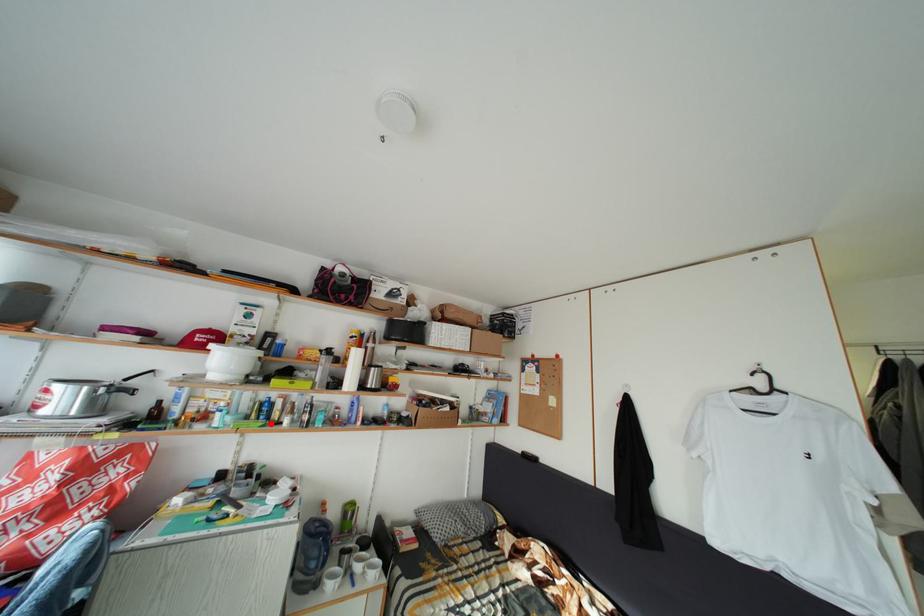
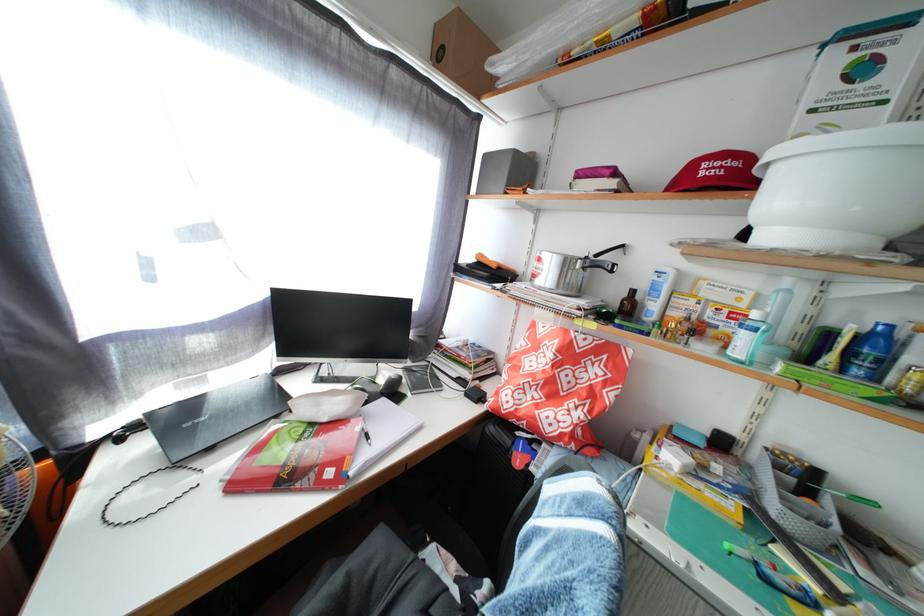
Question: I am providing you with two images of the same scene from different viewpoints. A red point is marked on the first image. Can you still see the location of the red point in image 2?

Choices:
 (A) Yes
 (B) No

Answer: (A)